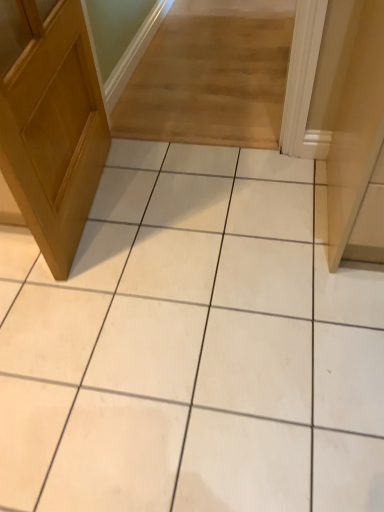
The image size is (384, 512). In order to click on matte wood door at left in this screenshot , I will do `click(53, 130)`.

The width and height of the screenshot is (384, 512). What do you see at coordinates (53, 130) in the screenshot? I see `matte wood door at left` at bounding box center [53, 130].

Identify the location of matte wood door at left. The height and width of the screenshot is (512, 384). (53, 130).